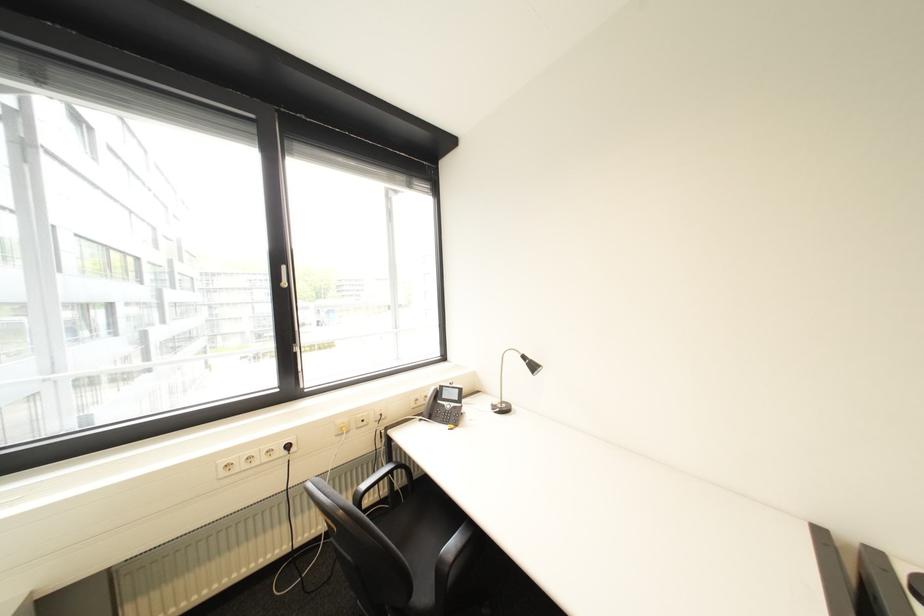
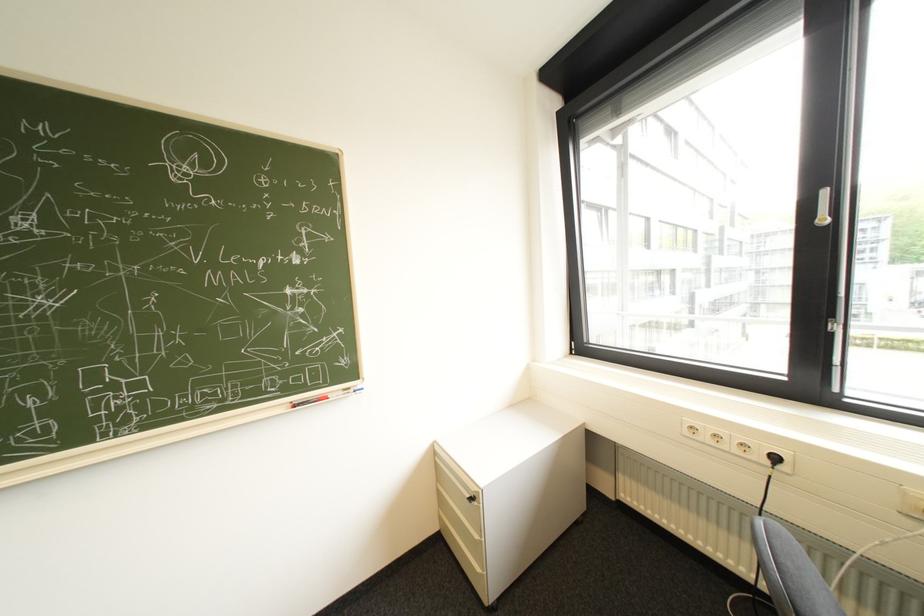
Find the pixel in the second image that matches [294,268] in the first image.

(834, 193)